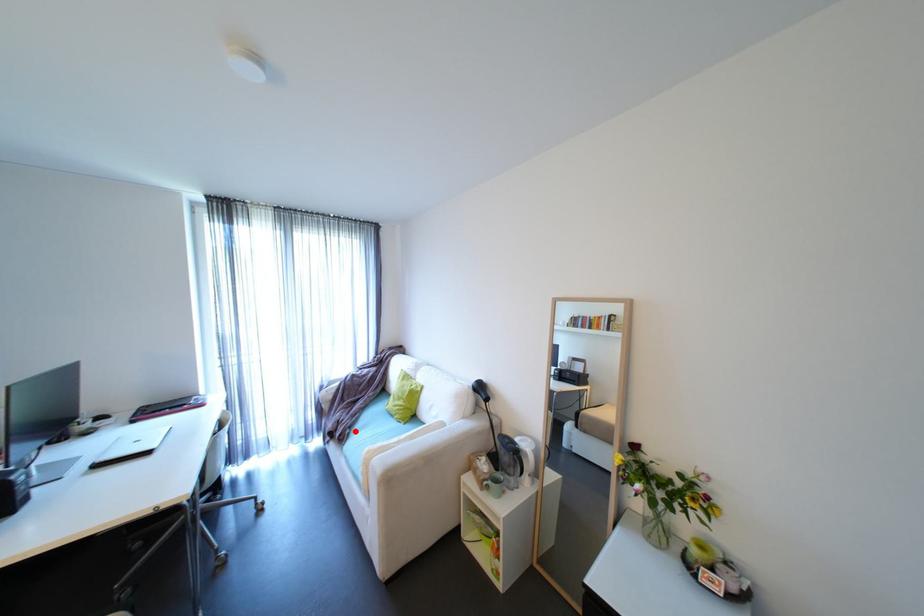
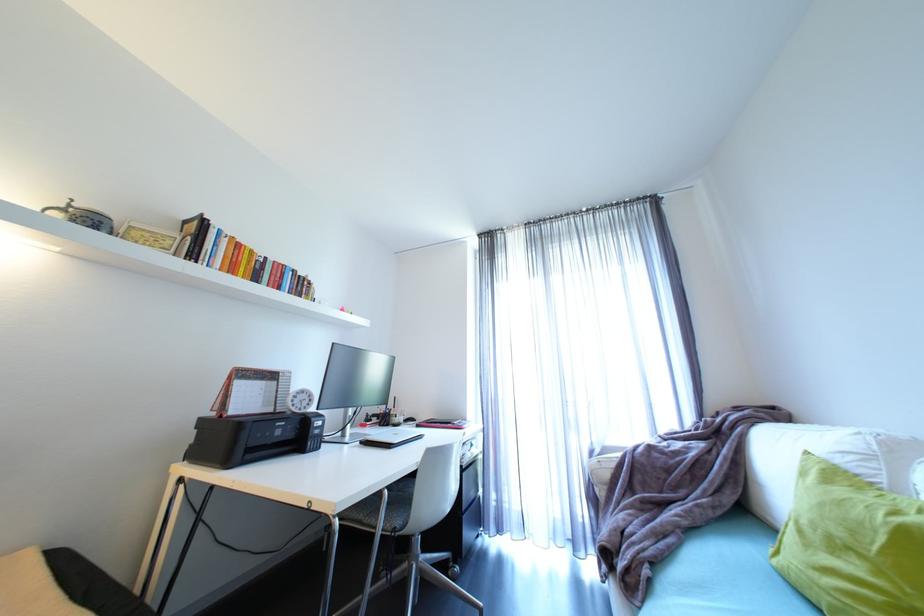
Where in the second image is the point corresponding to the highlighted location from the first image?

(653, 572)